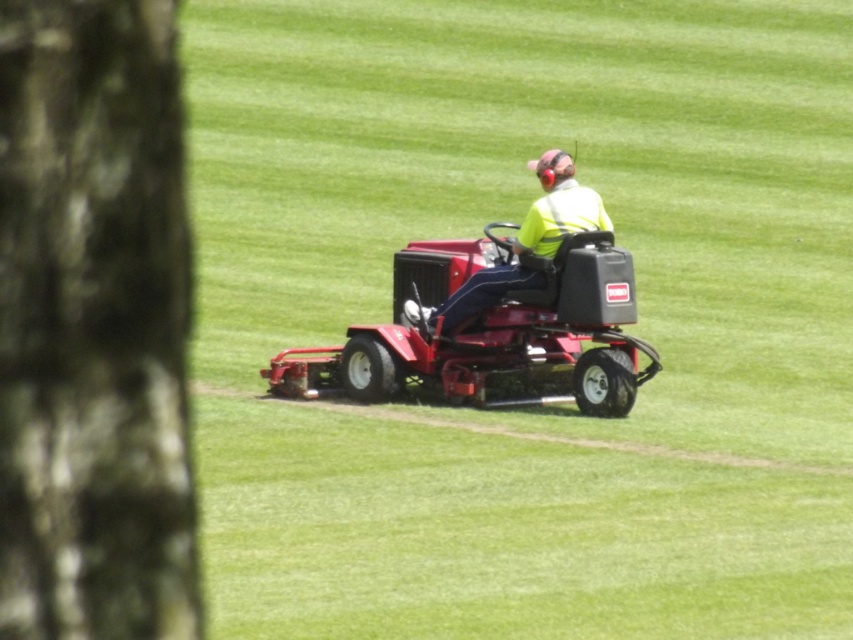
Between dark brown bark at left and yellow reflective vest at center, which one has more height?

yellow reflective vest at center

You are a GUI agent. You are given a task and a screenshot of the screen. Output one action in this format:
    pyautogui.click(x=<x>, y=<y>)
    Task: Click on the dark brown bark at left
    The height and width of the screenshot is (640, 853).
    Given the screenshot: What is the action you would take?
    pyautogui.click(x=94, y=324)

This screenshot has width=853, height=640. What are the coordinates of `dark brown bark at left` in the screenshot? It's located at (94, 324).

Locate an element on the screen. The width and height of the screenshot is (853, 640). dark brown bark at left is located at coordinates (94, 324).